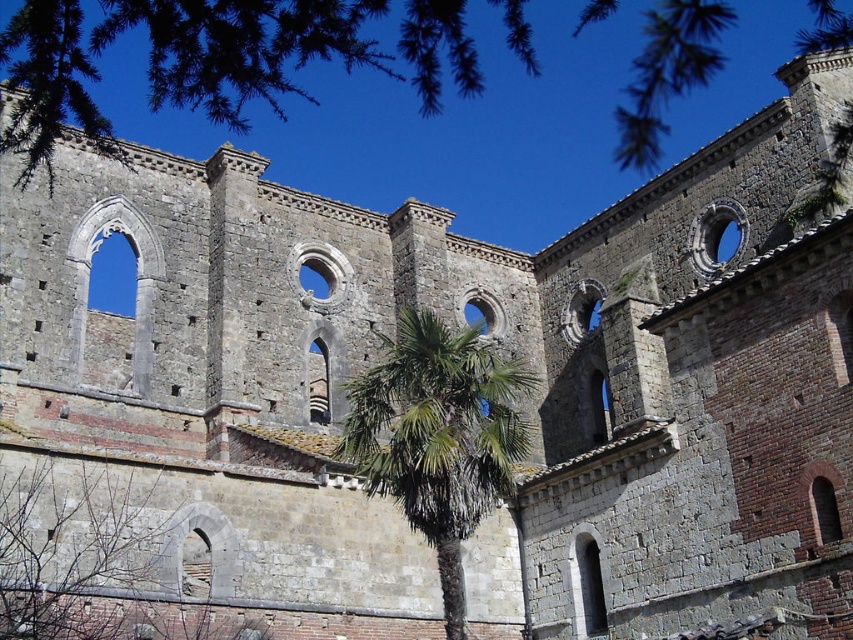
Question: Is green leafy palm at center below green leafy palm at lower center?

Choices:
 (A) no
 (B) yes

Answer: (A)

Question: Among these objects, which one is farthest from the camera?

Choices:
 (A) green leafy tree at upper center
 (B) green leafy palm at lower center

Answer: (B)

Question: Which object appears farthest from the camera in this image?

Choices:
 (A) green leafy tree at upper center
 (B) green leafy palm at lower center

Answer: (B)

Question: Does green leafy palm at center lie in front of green leafy palm at lower center?

Choices:
 (A) yes
 (B) no

Answer: (B)

Question: Does green leafy tree at upper center have a smaller size compared to green leafy palm at lower center?

Choices:
 (A) yes
 (B) no

Answer: (B)

Question: Which of the following is the closest to the observer?

Choices:
 (A) green leafy tree at upper center
 (B) green leafy palm at lower center
 (C) green leafy palm at center

Answer: (A)